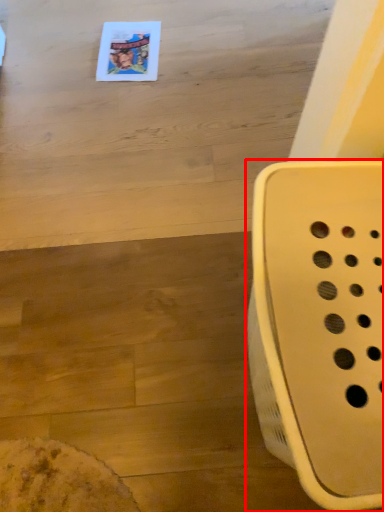
Question: From the image's perspective, considering the relative positions of furniture (annotated by the red box) and table in the image provided, where is furniture (annotated by the red box) located with respect to the staircase?

Choices:
 (A) above
 (B) below

Answer: (B)